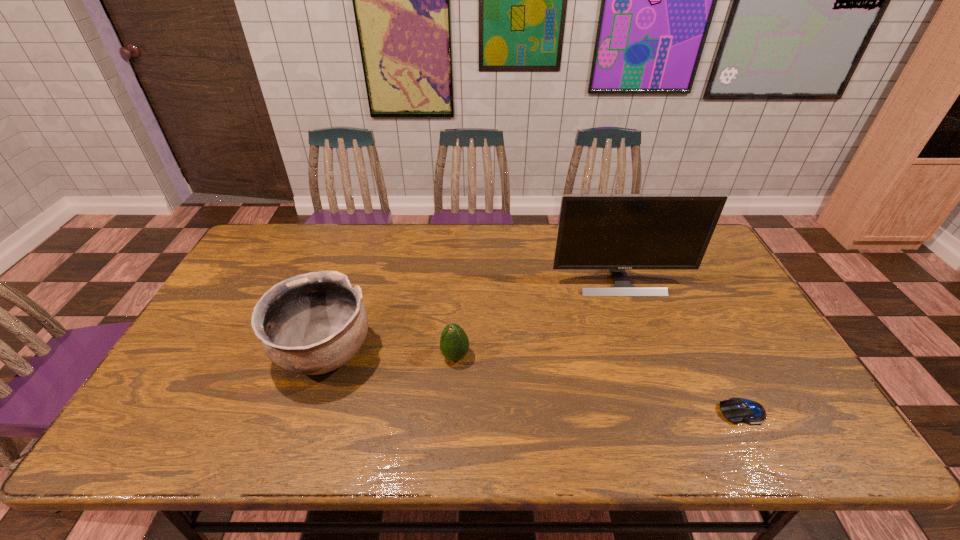
Image resolution: width=960 pixels, height=540 pixels. In the image, there is a desktop. Find the location of `vacant space at the left edge`. vacant space at the left edge is located at coordinates (202, 400).

The width and height of the screenshot is (960, 540). I want to click on vacant space at the right edge of the desktop, so click(x=779, y=405).

Locate an element on the screen. This screenshot has width=960, height=540. free space at the far left corner is located at coordinates (258, 240).

You are a GUI agent. You are given a task and a screenshot of the screen. Output one action in this format:
    pyautogui.click(x=<x>, y=<y>)
    Task: Click on the vacant area at the near left corner
    
    Given the screenshot: What is the action you would take?
    pos(188,423)

Image resolution: width=960 pixels, height=540 pixels. I want to click on empty space between the avocado and the pottery, so click(390, 355).

Where is `free space between the pottery and the third tallest object`? This screenshot has height=540, width=960. free space between the pottery and the third tallest object is located at coordinates (390, 355).

The width and height of the screenshot is (960, 540). What are the coordinates of `blank region between the avocado and the pottery` in the screenshot? It's located at (390, 355).

Find the location of `vacant space that's between the leftmost object and the tallest object`. vacant space that's between the leftmost object and the tallest object is located at coordinates (472, 317).

In order to click on free spot between the avocado and the farthest object in this screenshot , I will do `click(538, 319)`.

The width and height of the screenshot is (960, 540). I want to click on free space between the leftmost object and the avocado, so [x=390, y=355].